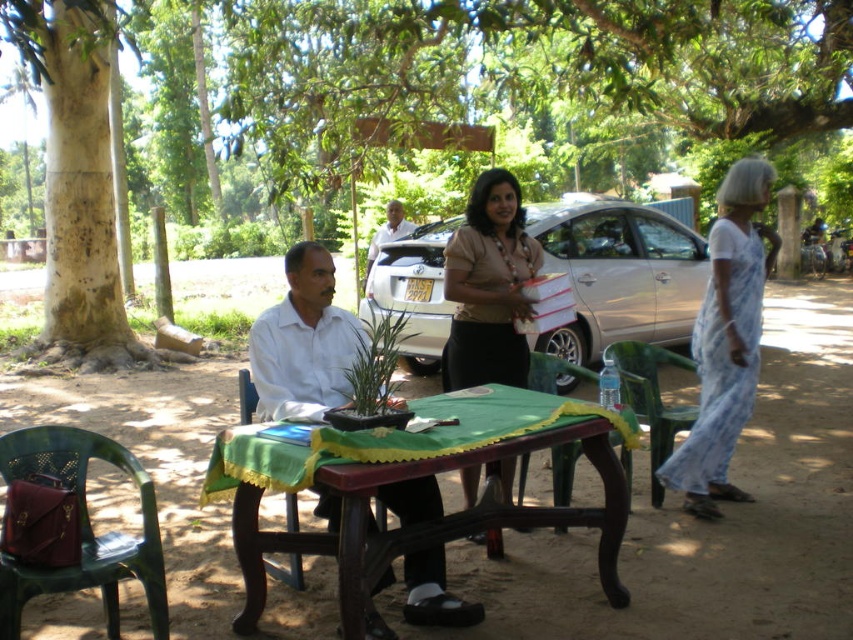
Is wooden picnic table at center thinner than silver metallic car at center?

Indeed, wooden picnic table at center has a lesser width compared to silver metallic car at center.

Can you confirm if wooden picnic table at center is smaller than silver metallic car at center?

Indeed, wooden picnic table at center has a smaller size compared to silver metallic car at center.

This screenshot has height=640, width=853. Find the location of `wooden picnic table at center`. wooden picnic table at center is located at coordinates (410, 477).

Find the location of a particular element. Image resolution: width=853 pixels, height=640 pixels. wooden picnic table at center is located at coordinates (410, 477).

Is wooden picnic table at center bigger than rough bark tree at left?

Yes, wooden picnic table at center is bigger than rough bark tree at left.

Can you confirm if wooden picnic table at center is positioned to the right of rough bark tree at left?

Indeed, wooden picnic table at center is positioned on the right side of rough bark tree at left.

Between point (218, 461) and point (103, 317), which one is positioned behind?

The point (103, 317) is behind.

Identify the location of wooden picnic table at center. (410, 477).

Between white cotton dress at right and matte beige blouse at center, which one has more height?

Standing taller between the two is white cotton dress at right.

Is white cotton dress at right to the right of matte beige blouse at center from the viewer's perspective?

Indeed, white cotton dress at right is positioned on the right side of matte beige blouse at center.

Does point (728, 490) come farther from viewer compared to point (477, 204)?

Yes, it is behind point (477, 204).

Locate an element on the screen. Image resolution: width=853 pixels, height=640 pixels. white cotton dress at right is located at coordinates (724, 340).